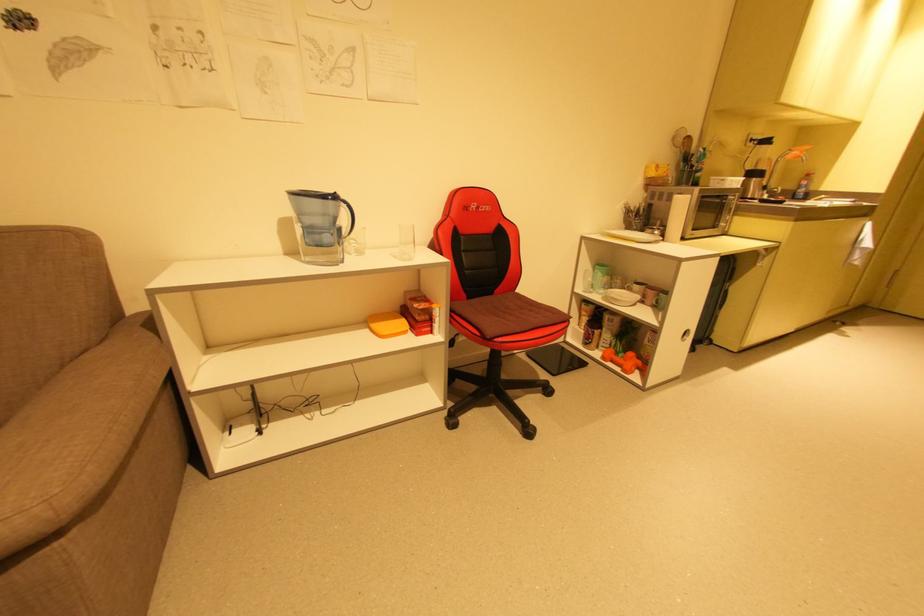
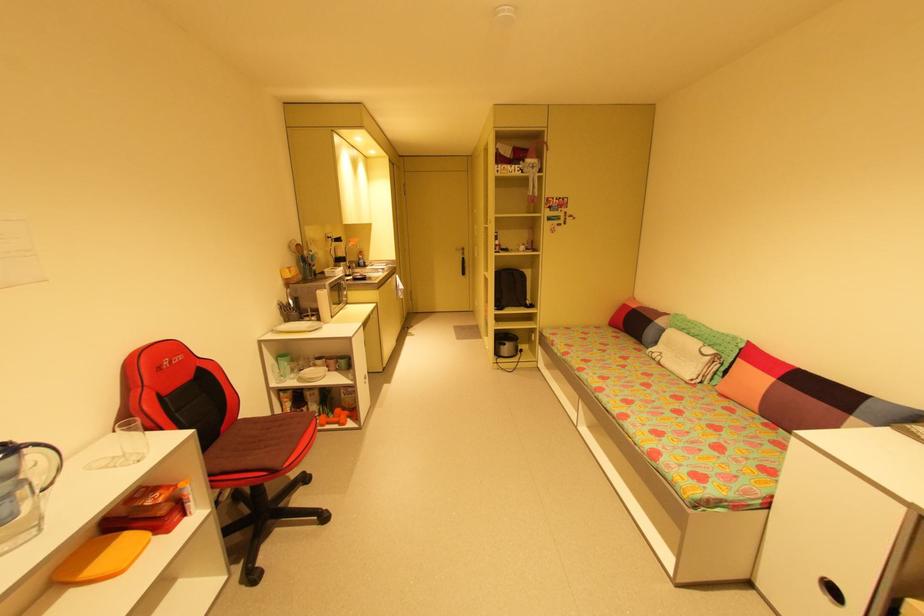
In the second image, find the point that corresponds to point 603,274 in the first image.

(290, 363)